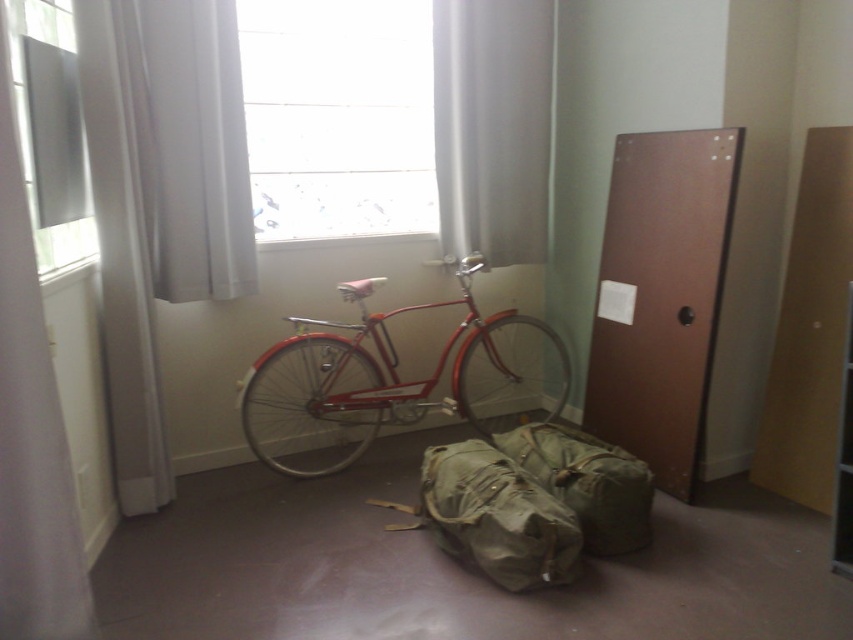
You are standing in the room and want to open the white sheer curtain at left to let more light in. Can you reach it without moving the shiny red bicycle at center?

The white sheer curtain at left is behind the shiny red bicycle at center, so you cannot reach it without moving the bicycle first.

You are standing in the room and want to know if the point at coordinate (389, 212) is closer to you than the point at (593, 547). Can you determine this based on the scene?

Yes, the point at coordinate (389, 212) is closer to you than the point at (593, 547) because it is further to the camera, meaning it is physically nearer in the scene.